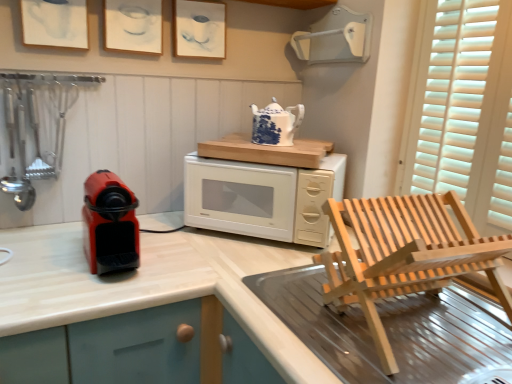
Question: Considering the relative positions of natural wood chair at lower right and matte paper picture frame at upper center, which is the second picture frame in right-to-left order, in the image provided, is natural wood chair at lower right behind matte paper picture frame at upper center, which is the second picture frame in right-to-left order,?

Choices:
 (A) no
 (B) yes

Answer: (A)

Question: Is natural wood chair at lower right positioned before matte paper picture frame at upper center, which is the second picture frame in right-to-left order?

Choices:
 (A) no
 (B) yes

Answer: (B)

Question: Is natural wood chair at lower right at the left side of matte paper picture frame at upper center, the 2th picture frame positioned from the left?

Choices:
 (A) no
 (B) yes

Answer: (A)

Question: Is natural wood chair at lower right shorter than matte paper picture frame at upper center, the 2th picture frame positioned from the left?

Choices:
 (A) yes
 (B) no

Answer: (B)

Question: Is natural wood chair at lower right directly adjacent to matte paper picture frame at upper center, which is the second picture frame in right-to-left order?

Choices:
 (A) yes
 (B) no

Answer: (B)

Question: Is natural wood chair at lower right to the right of matte paper picture frame at upper center, the 2th picture frame positioned from the left, from the viewer's perspective?

Choices:
 (A) yes
 (B) no

Answer: (A)

Question: Is white glossy microwave oven at center outside of blue and white ceramic teapot at upper center?

Choices:
 (A) yes
 (B) no

Answer: (A)

Question: Can you confirm if white glossy microwave oven at center is thinner than blue and white ceramic teapot at upper center?

Choices:
 (A) no
 (B) yes

Answer: (A)

Question: From a real-world perspective, is white glossy microwave oven at center over blue and white ceramic teapot at upper center?

Choices:
 (A) no
 (B) yes

Answer: (A)

Question: From a real-world perspective, is white glossy microwave oven at center beneath blue and white ceramic teapot at upper center?

Choices:
 (A) yes
 (B) no

Answer: (A)

Question: Considering the relative positions of white glossy microwave oven at center and blue and white ceramic teapot at upper center in the image provided, is white glossy microwave oven at center to the left of blue and white ceramic teapot at upper center from the viewer's perspective?

Choices:
 (A) yes
 (B) no

Answer: (A)

Question: Are white glossy microwave oven at center and blue and white ceramic teapot at upper center beside each other?

Choices:
 (A) yes
 (B) no

Answer: (B)

Question: Can you confirm if matte paper picture frame at upper left, arranged as the 1th picture frame when viewed from the left, is thinner than natural wood chair at lower right?

Choices:
 (A) yes
 (B) no

Answer: (A)